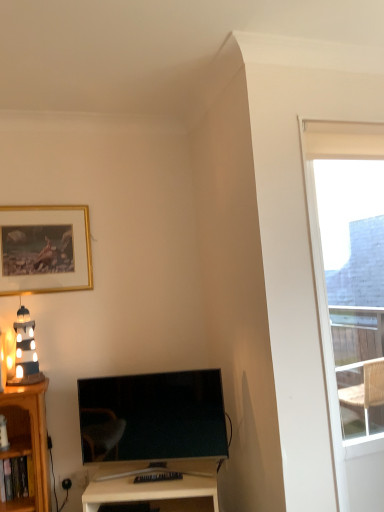
Question: Is transparent glass window at upper right wider than matte black lighthouse at left?

Choices:
 (A) no
 (B) yes

Answer: (A)

Question: Is transparent glass window at upper right at the left side of matte black lighthouse at left?

Choices:
 (A) yes
 (B) no

Answer: (B)

Question: From a real-world perspective, is transparent glass window at upper right on matte black lighthouse at left?

Choices:
 (A) no
 (B) yes

Answer: (A)

Question: Can you confirm if transparent glass window at upper right is shorter than matte black lighthouse at left?

Choices:
 (A) no
 (B) yes

Answer: (A)

Question: From a real-world perspective, is transparent glass window at upper right located beneath matte black lighthouse at left?

Choices:
 (A) yes
 (B) no

Answer: (A)

Question: Is transparent glass window at upper right turned away from matte black lighthouse at left?

Choices:
 (A) yes
 (B) no

Answer: (B)

Question: Does matte black lighthouse at left have a larger size compared to matte black tv at lower center?

Choices:
 (A) yes
 (B) no

Answer: (B)

Question: Is matte black lighthouse at left taller than matte black tv at lower center?

Choices:
 (A) no
 (B) yes

Answer: (A)

Question: Is matte black lighthouse at left wider than matte black tv at lower center?

Choices:
 (A) yes
 (B) no

Answer: (A)

Question: Considering the relative positions of matte black lighthouse at left and matte black tv at lower center in the image provided, is matte black lighthouse at left to the right of matte black tv at lower center from the viewer's perspective?

Choices:
 (A) no
 (B) yes

Answer: (A)

Question: Is matte black lighthouse at left further to the viewer compared to matte black tv at lower center?

Choices:
 (A) no
 (B) yes

Answer: (B)

Question: Could you tell me if matte black lighthouse at left is turned towards matte black tv at lower center?

Choices:
 (A) no
 (B) yes

Answer: (A)

Question: From a real-world perspective, is matte black tv at lower center below gold-framed picture at upper left?

Choices:
 (A) yes
 (B) no

Answer: (A)